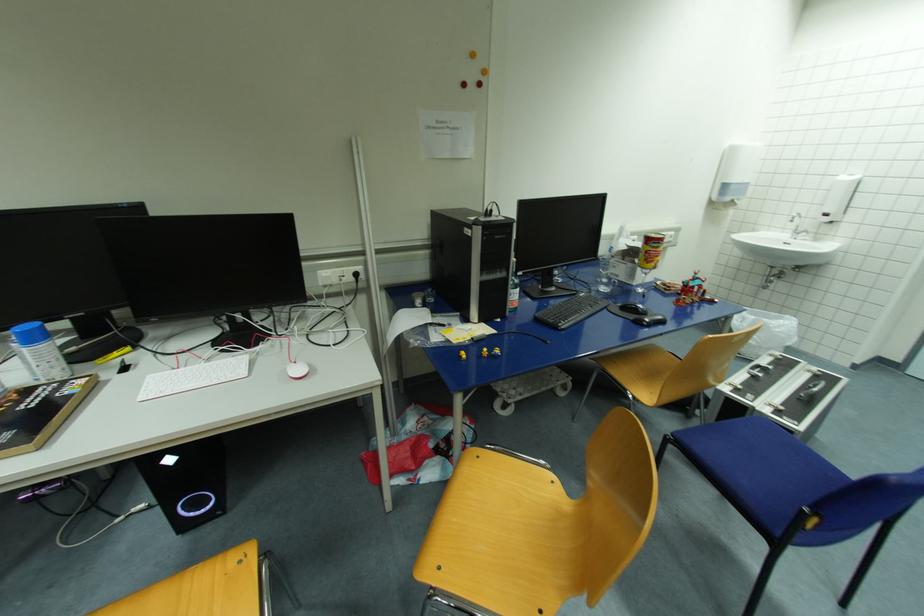
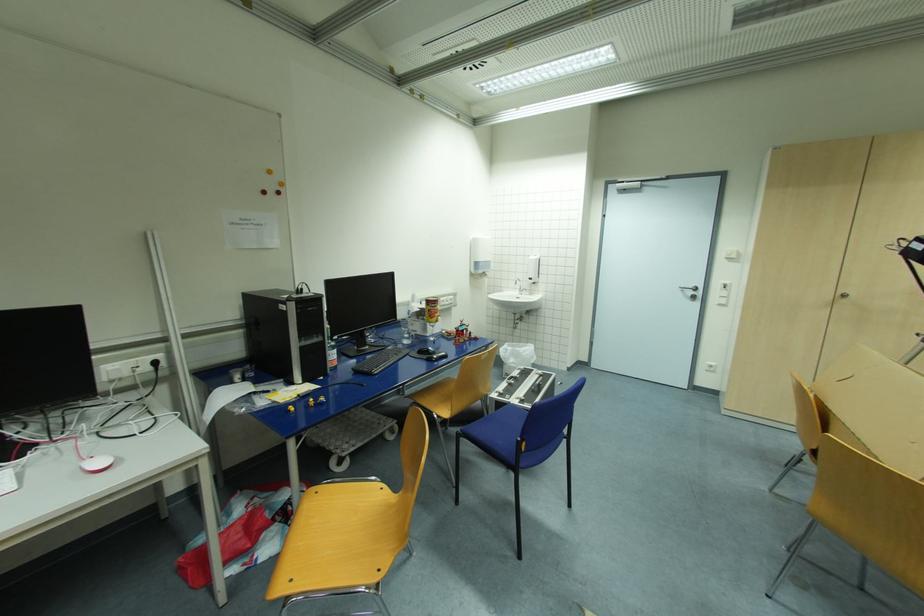
In the second image, find the point that corresponds to [481,459] in the first image.

(320, 493)